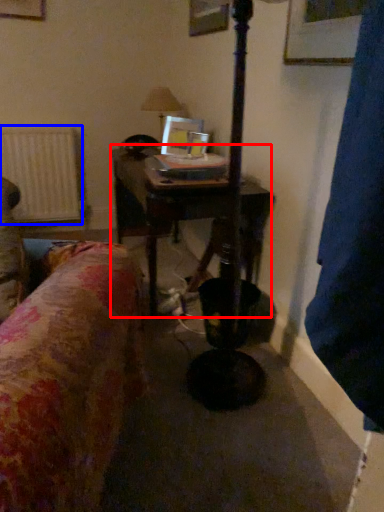
Question: Which of the following is the closest to the observer, table (highlighted by a red box) or radiator (highlighted by a blue box)?

Choices:
 (A) table
 (B) radiator

Answer: (A)